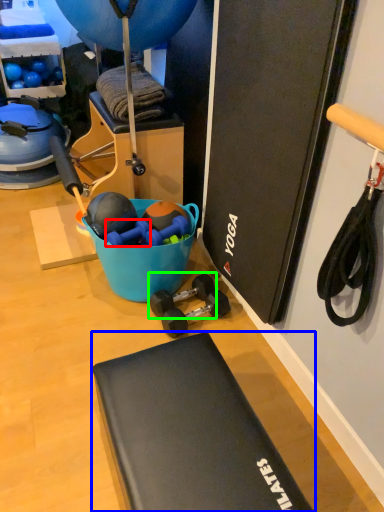
Question: Considering the real-world distances, which object is farthest from dumbbell (highlighted by a red box)? furniture (highlighted by a blue box) or dumbbell (highlighted by a green box)?

Choices:
 (A) furniture
 (B) dumbbell

Answer: (A)